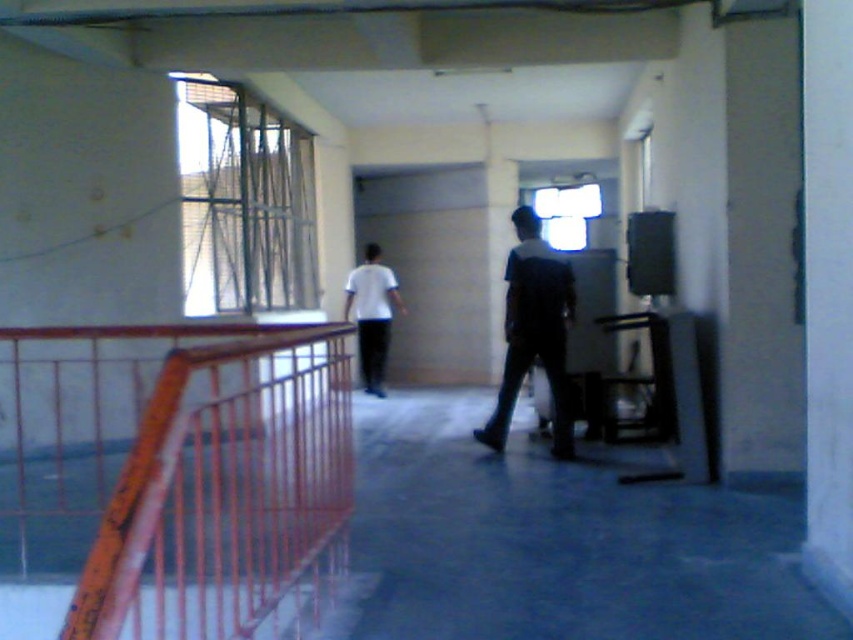
Measure the distance between orange painted metal railing at left and dark blue fabric shirt at center.

orange painted metal railing at left and dark blue fabric shirt at center are 7.51 feet apart from each other.

Does orange painted metal railing at left lie behind dark blue fabric shirt at center?

No, orange painted metal railing at left is closer to the viewer.

At what (x,y) coordinates should I click in order to perform the action: click on orange painted metal railing at left. Please return your answer as a coordinate pair (x, y). The image size is (853, 640). Looking at the image, I should click on click(x=167, y=476).

The width and height of the screenshot is (853, 640). What are the coordinates of `orange painted metal railing at left` in the screenshot? It's located at (167, 476).

Is dark blue fabric shirt at center further to the viewer compared to white matte shirt at center?

No, dark blue fabric shirt at center is closer to the viewer.

Where is `dark blue fabric shirt at center`? The width and height of the screenshot is (853, 640). dark blue fabric shirt at center is located at coordinates (532, 332).

Find the location of a particular element. The image size is (853, 640). dark blue fabric shirt at center is located at coordinates (532, 332).

Can you confirm if orange painted metal railing at left is positioned to the right of white matte shirt at center?

Correct, you'll find orange painted metal railing at left to the right of white matte shirt at center.

Is orange painted metal railing at left wider than white matte shirt at center?

Correct, the width of orange painted metal railing at left exceeds that of white matte shirt at center.

Between point (149, 547) and point (347, 312), which one is positioned in front?

Point (149, 547) is more forward.

This screenshot has height=640, width=853. I want to click on orange painted metal railing at left, so click(x=167, y=476).